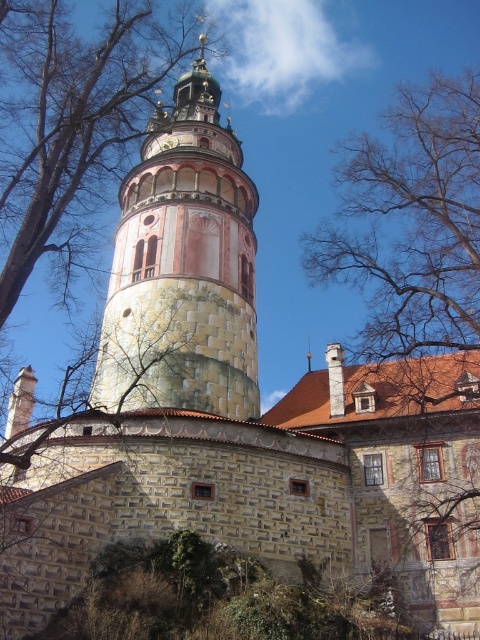
You are an architect examining the historic building. You notice the stone tower at center and the metallic gold clock at center. Based on their positions, which one is positioned higher in the image?

The metallic gold clock at center is positioned higher than the stone tower at center, as the stone tower at center is below the metallic gold clock at center.

You are an architect visiting the historic site and want to take a photo of the stone tower at center and the metallic gold clock at center. From your current position, which object will appear larger in the photo?

The stone tower at center will appear larger in the photo because it is in front of the metallic gold clock at center, making it closer to the camera and thus larger in the frame.